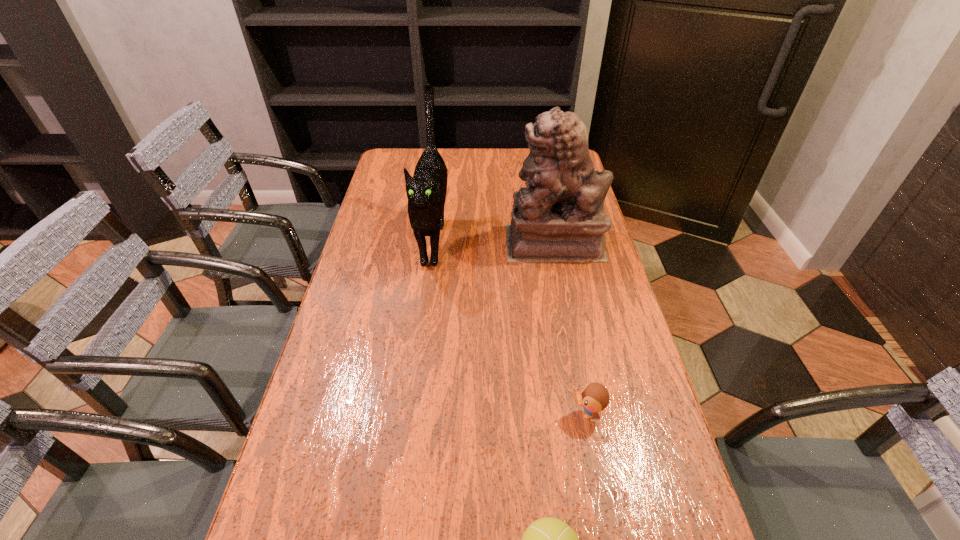
At what (x,y) coordinates should I click in order to perform the action: click on the leftmost object. Please return your answer as a coordinate pair (x, y). The height and width of the screenshot is (540, 960). Looking at the image, I should click on (426, 191).

At what (x,y) coordinates should I click in order to perform the action: click on sculpture. Please return your answer as a coordinate pair (x, y). The image size is (960, 540). Looking at the image, I should click on (559, 217).

Where is `duck`? This screenshot has width=960, height=540. duck is located at coordinates (594, 397).

You are a GUI agent. You are given a task and a screenshot of the screen. Output one action in this format:
    pyautogui.click(x=<x>, y=<y>)
    Task: Click on the vacant space positioned 0.370m on the face of the cat
    
    Given the screenshot: What is the action you would take?
    pyautogui.click(x=414, y=393)

You are a GUI agent. You are given a task and a screenshot of the screen. Output one action in this format:
    pyautogui.click(x=<x>, y=<y>)
    Task: Click on the vacant region located on the front-facing side of the sculpture
    The width and height of the screenshot is (960, 540).
    Given the screenshot: What is the action you would take?
    pyautogui.click(x=450, y=242)

Locate an element on the screen. free spot located on the front-facing side of the sculpture is located at coordinates (438, 242).

You are a GUI agent. You are given a task and a screenshot of the screen. Output one action in this format:
    pyautogui.click(x=<x>, y=<y>)
    Task: Click on the free space located 0.050m on the front-facing side of the sculpture
    This screenshot has height=540, width=960.
    Given the screenshot: What is the action you would take?
    pyautogui.click(x=491, y=242)

This screenshot has width=960, height=540. I want to click on free space located 0.290m on the front-facing side of the duck, so click(x=439, y=414).

Where is `free space located 0.070m on the front-facing side of the duck`? This screenshot has width=960, height=540. free space located 0.070m on the front-facing side of the duck is located at coordinates (538, 414).

I want to click on vacant space situated on the front-facing side of the duck, so click(506, 414).